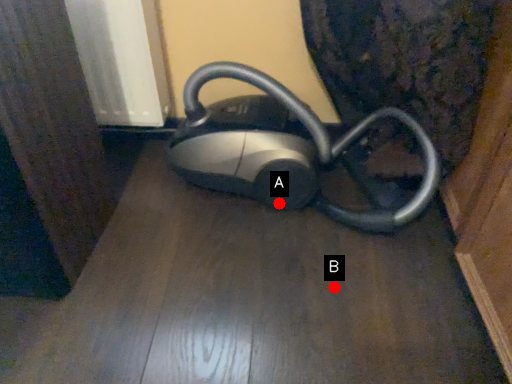
Question: Two points are circled on the image, labeled by A and B beside each circle. Which point is further to the camera?

Choices:
 (A) A is further
 (B) B is further

Answer: (A)